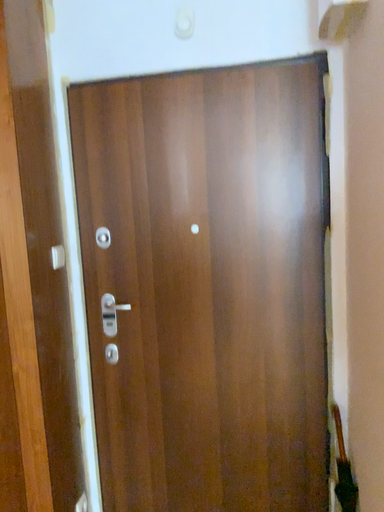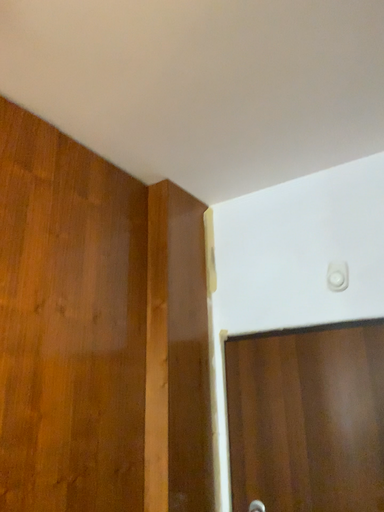
Question: Which way did the camera rotate in the video?

Choices:
 (A) rotated downward
 (B) rotated upward

Answer: (B)